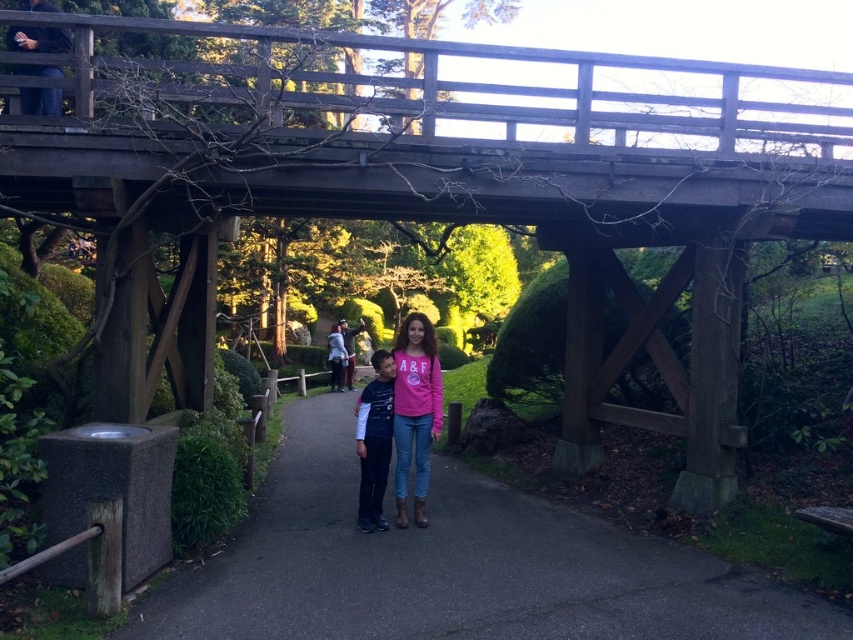
Question: Is pink cotton shirt at center above matte blue jeans at center?

Choices:
 (A) yes
 (B) no

Answer: (B)

Question: Which point is farther to the camera?

Choices:
 (A) black asphalt path at center
 (B) matte blue jeans at center

Answer: (B)

Question: Estimate the real-world distances between objects in this image. Which object is closer to the pink cotton shirt at center?

Choices:
 (A) matte blue jeans at center
 (B) black asphalt path at center

Answer: (A)

Question: Which point is closer to the camera?

Choices:
 (A) (749, 602)
 (B) (398, 445)
 (C) (373, 529)

Answer: (A)

Question: Does black asphalt path at center lie behind matte blue jeans at center?

Choices:
 (A) no
 (B) yes

Answer: (A)

Question: Does black asphalt path at center appear on the right side of pink cotton shirt at center?

Choices:
 (A) yes
 (B) no

Answer: (B)